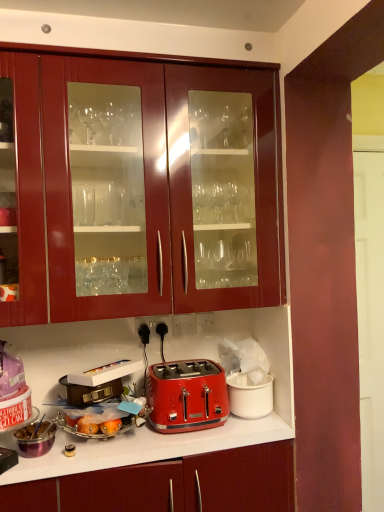
Question: From a real-world perspective, is glossy wood cabinets at upper center physically below black plastic electrical outlet at lower center?

Choices:
 (A) no
 (B) yes

Answer: (A)

Question: Are glossy wood cabinets at upper center and black plastic electrical outlet at lower center located far from each other?

Choices:
 (A) no
 (B) yes

Answer: (A)

Question: From the image's perspective, is glossy wood cabinets at upper center above black plastic electrical outlet at lower center?

Choices:
 (A) no
 (B) yes

Answer: (B)

Question: Does glossy wood cabinets at upper center have a larger size compared to black plastic electrical outlet at lower center?

Choices:
 (A) no
 (B) yes

Answer: (B)

Question: Is glossy wood cabinets at upper center to the right of black plastic electrical outlet at lower center from the viewer's perspective?

Choices:
 (A) yes
 (B) no

Answer: (B)

Question: Can you confirm if glossy wood cabinets at upper center is thinner than black plastic electrical outlet at lower center?

Choices:
 (A) no
 (B) yes

Answer: (A)

Question: Does red plastic toaster at center, the 3th appliance viewed from the left, lie in front of metallic silver toaster at lower left?

Choices:
 (A) yes
 (B) no

Answer: (B)

Question: From the image's perspective, would you say red plastic toaster at center, the 3th appliance viewed from the left, is shown under metallic silver toaster at lower left?

Choices:
 (A) yes
 (B) no

Answer: (B)

Question: Is red plastic toaster at center, the 3th appliance viewed from the left, at the right side of metallic silver toaster at lower left?

Choices:
 (A) yes
 (B) no

Answer: (A)

Question: Is red plastic toaster at center, acting as the 1th appliance starting from the right, far away from metallic silver toaster at lower left?

Choices:
 (A) no
 (B) yes

Answer: (A)

Question: Is metallic silver toaster at lower left surrounded by red plastic toaster at center, the 3th appliance viewed from the left?

Choices:
 (A) no
 (B) yes

Answer: (A)

Question: Considering the relative sizes of red plastic toaster at center, acting as the 1th appliance starting from the right, and metallic silver toaster at lower left in the image provided, is red plastic toaster at center, acting as the 1th appliance starting from the right, bigger than metallic silver toaster at lower left?

Choices:
 (A) no
 (B) yes

Answer: (B)

Question: Is red metallic toaster at center thinner than brown leather suitcase at lower left, the second appliance viewed from the left?

Choices:
 (A) yes
 (B) no

Answer: (B)